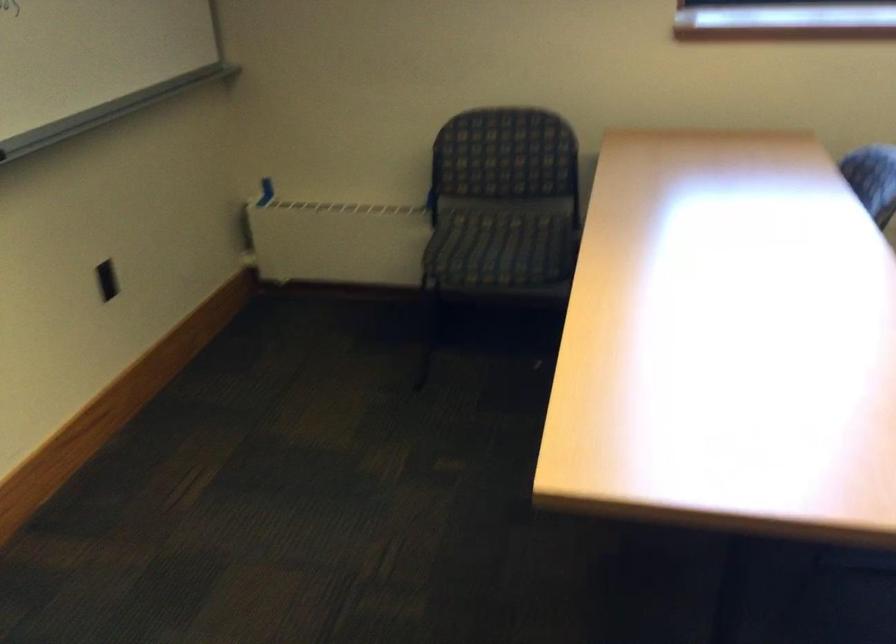
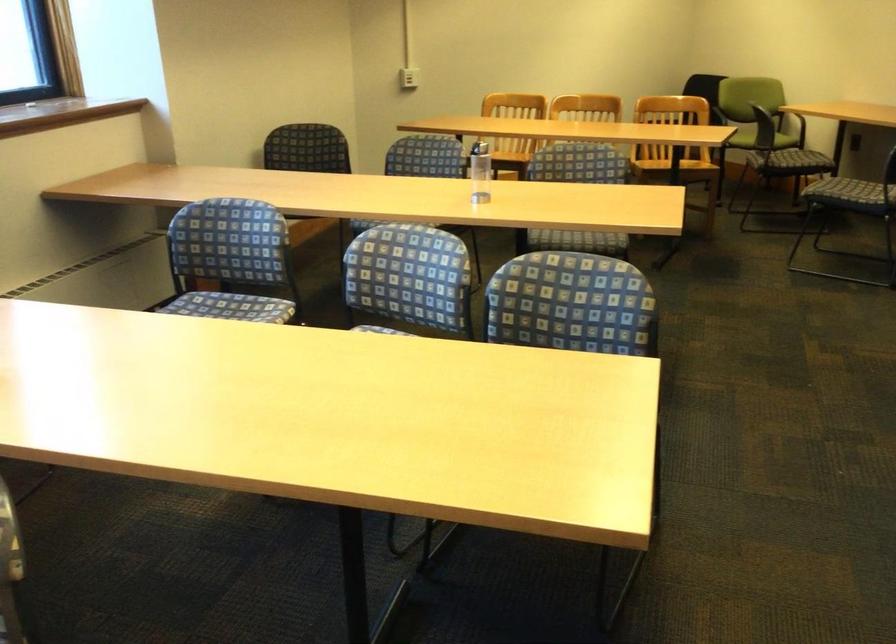
Question: Based on the continuous images, in which direction is the camera rotating? Reply with the corresponding letter.

Choices:
 (A) Left
 (B) Right
 (C) Up
 (D) Down

Answer: (B)